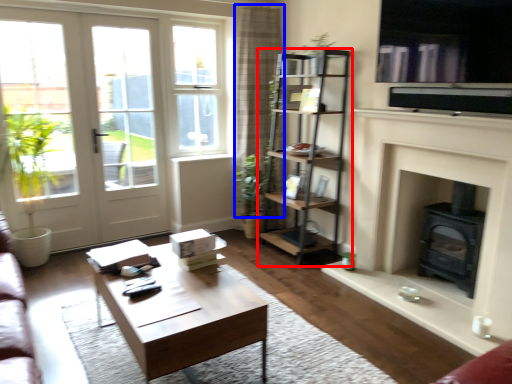
Question: Which point is further to the camera, shelf (highlighted by a red box) or curtain (highlighted by a blue box)?

Choices:
 (A) shelf
 (B) curtain

Answer: (B)